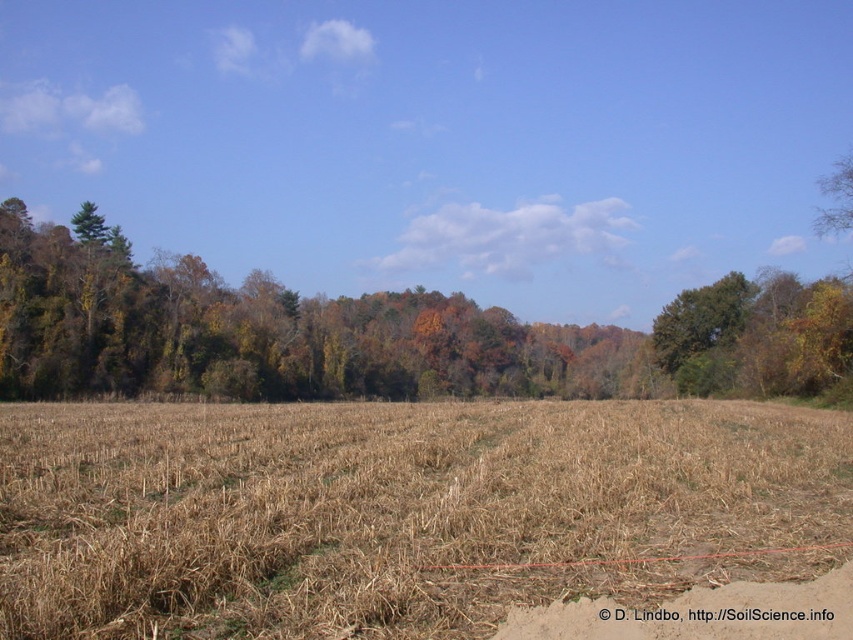
Does brown dry grass at center have a smaller size compared to brown dirt track at lower center?

No.

Who is positioned more to the right, brown dry grass at center or brown dirt track at lower center?

Positioned to the right is brown dirt track at lower center.

Is point (20, 620) closer to viewer compared to point (664, 628)?

Yes, it is.

The width and height of the screenshot is (853, 640). In order to click on brown dry grass at center in this screenshot , I will do `click(399, 513)`.

Which of these two, brown dry grass at center or green leafy tree at center, stands shorter?

brown dry grass at center

Identify the location of brown dry grass at center. (399, 513).

Identify the location of brown dry grass at center. (399, 513).

Is point (552, 637) positioned in front of point (709, 332)?

Yes, it is.

Is brown dirt track at lower center smaller than green leafy tree at center?

Indeed, brown dirt track at lower center has a smaller size compared to green leafy tree at center.

Between point (817, 577) and point (659, 339), which one is positioned in front?

Point (817, 577)

Identify the location of brown dirt track at lower center. (701, 612).